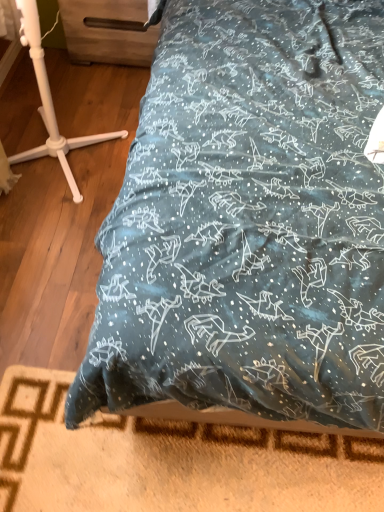
Locate an element on the screen. Image resolution: width=384 pixels, height=512 pixels. free spot above wooden bed frame at lower center (from a real-world perspective) is located at coordinates (171, 464).